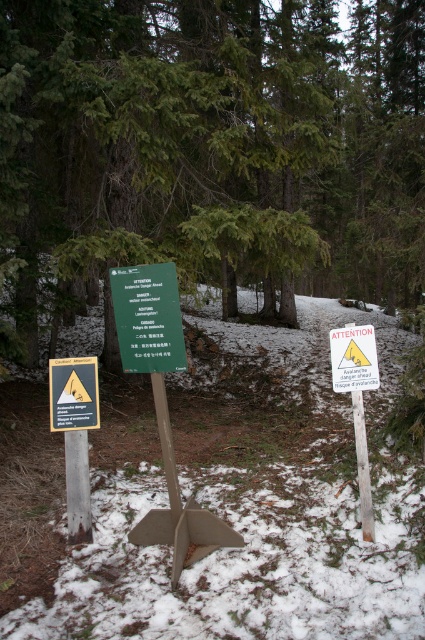
You are a hiker navigating through the snowy forest and see two points marked on your map. The first point is at coordinates point (159, 280) and the second point is at point (85, 406). Which point is closer to you when you are facing north?

Point (159, 280) is in front of point (85, 406), so when facing north, the first point is closer to you.

You are standing in a snowy forest and see three signs. The left sign is yellow with a black warning symbol, the middle is green with white text, and the right is white with a yellow triangle. There is a point at coordinates point (73, 394). Which sign is this point located on?

The point (73, 394) is on the yellow material texture sign at left.